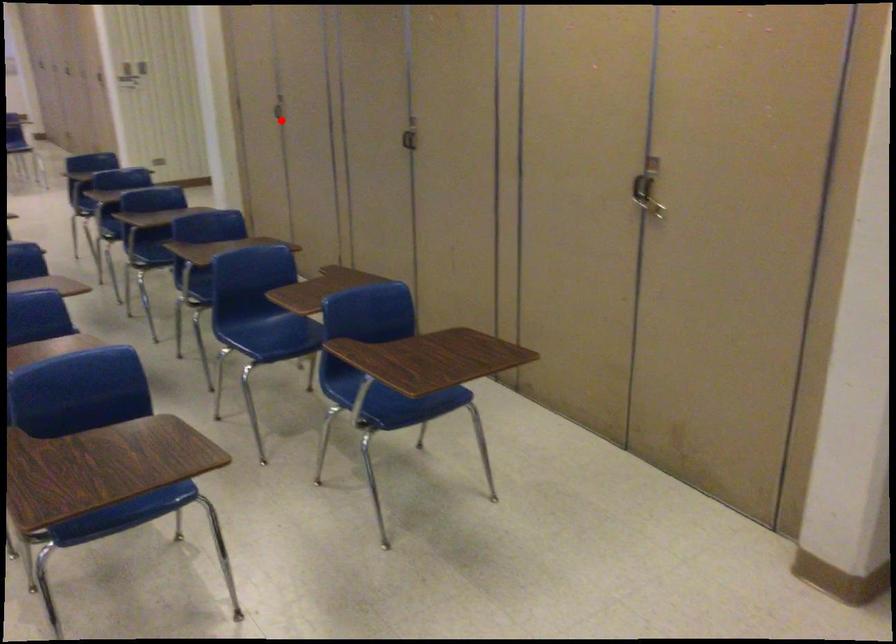
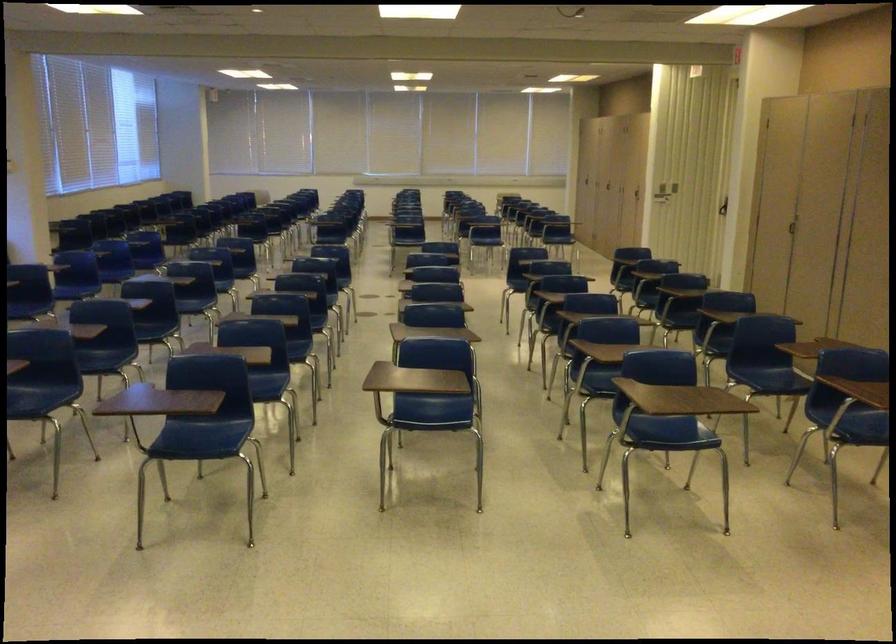
Question: I am providing you with two images of the same scene from different viewpoints. In image1, a red point is highlighted. Considering the same 3D point in image2, which of the following is correct?

Choices:
 (A) It is closer
 (B) It is farther

Answer: (B)